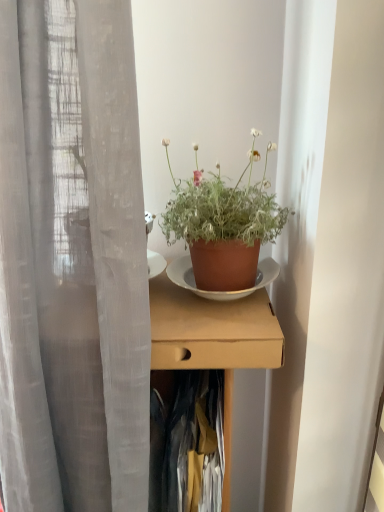
In order to click on free point above brown cardboard box at center (from a real-world perspective) in this screenshot , I will do `click(208, 310)`.